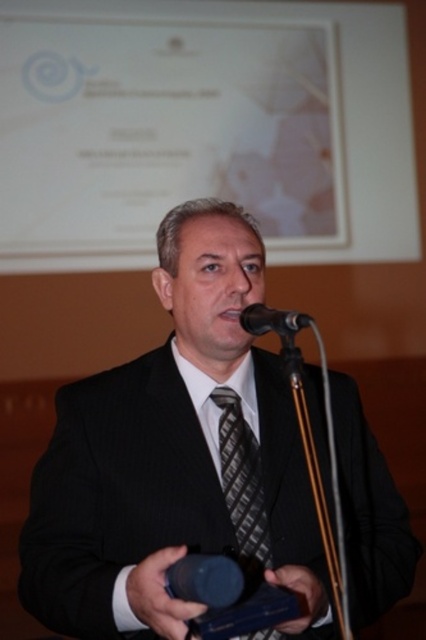
You are an event planner checking the setup for a presentation. You notice the black textured tie at center and the black matte microphone at center. Which object is taller in the image?

The black textured tie at center is much taller than the black matte microphone at center according to the description.

You are an event organizer setting up a camera to capture the man in the black pinstripe suit at center during his speech. Based on his position coordinates, where should you aim the camera to ensure he is centered in the frame?

The black pinstripe suit at center is located at point (175, 456), so the camera should be aimed at those coordinates to center him in the frame.

You are a photographer at a formal event. You want to take a closeup photo of the man while ensuring both the black textured tie at center and the black matte microphone at center are visible. Which object will appear larger in the photo?

The black textured tie at center will appear larger in the photo because it is bigger than the black matte microphone at center according to the description.